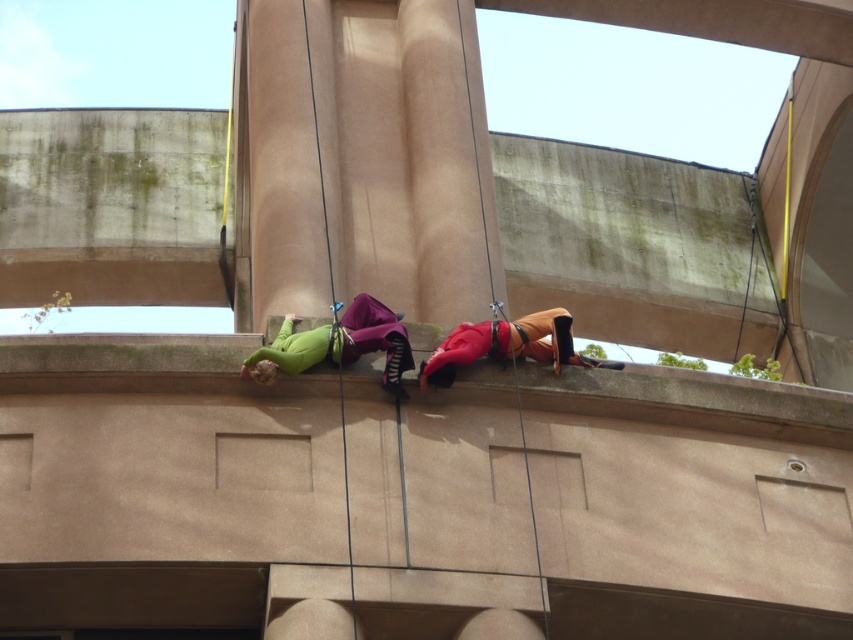
In the scene shown: You are a safety inspector checking the rappelling setup. You notice a point at coordinates (x=337, y=344). Which object is this point located on?

The point at coordinates (x=337, y=344) is located on the green matte suede pants at center.